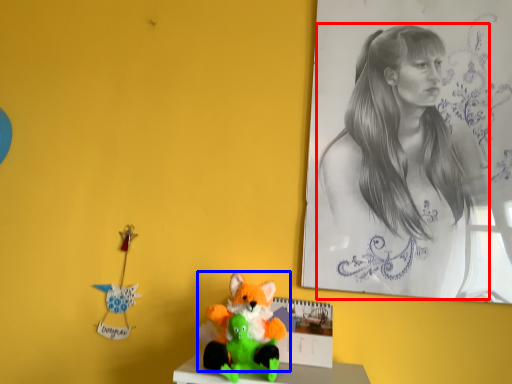
Question: Which of the following is the closest to the observer, woman (highlighted by a red box) or toy (highlighted by a blue box)?

Choices:
 (A) woman
 (B) toy

Answer: (B)